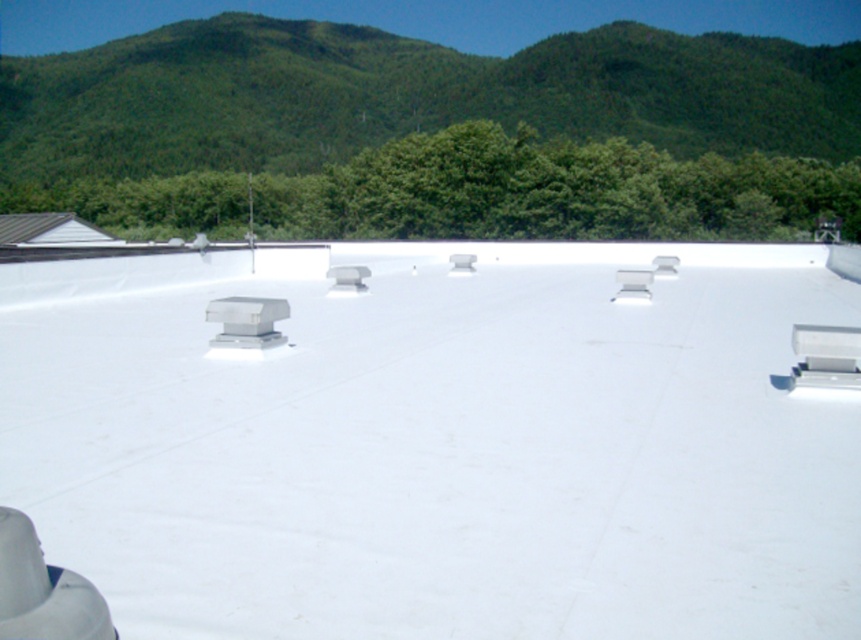
Is point (339, 188) farther from camera compared to point (35, 230)?

Yes, point (339, 188) is farther from viewer.

Between green forested hill at upper center and metallic gray roof at left, which one appears on the left side from the viewer's perspective?

metallic gray roof at left

Is point (53, 74) positioned behind point (28, 241)?

Yes, it is.

At what (x,y) coordinates should I click in order to perform the action: click on green forested hill at upper center. Please return your answer as a coordinate pair (x, y). The width and height of the screenshot is (861, 640). Looking at the image, I should click on (437, 132).